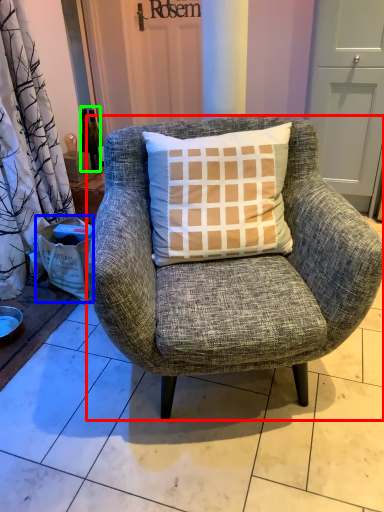
Question: Which object is the farthest from chair (highlighted by a red box)? Choose among these: box (highlighted by a blue box) or bottle (highlighted by a green box).

Choices:
 (A) box
 (B) bottle

Answer: (B)